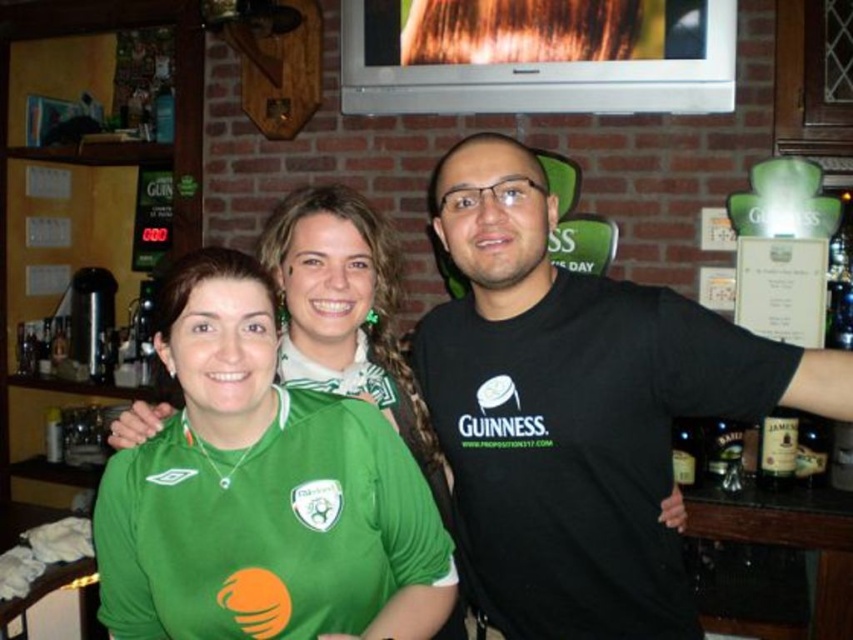
You are a photographer setting up a shot of the three people in the scene. You want to ensure that the green jersey at center and the brown glass bottle at right are both clearly visible in the frame. Given their sizes, which object should you prioritize positioning closer to the camera to maintain clarity?

The green jersey at center should be positioned closer to the camera since its width is larger than the brown glass bottle at right, allowing it to remain clear even if slightly farther away while ensuring the smaller bottle is still in focus.